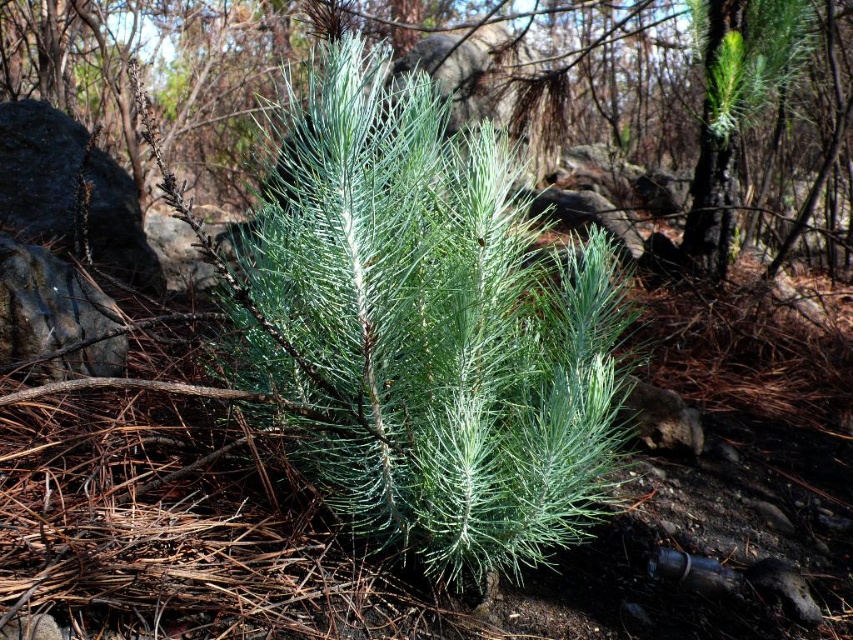
Question: Can you confirm if green needle-like plant at center is bigger than green needle-like plant at upper right?

Choices:
 (A) yes
 (B) no

Answer: (B)

Question: From the image, what is the correct spatial relationship of green needle-like plant at center in relation to green needle-like plant at upper right?

Choices:
 (A) left
 (B) right

Answer: (B)

Question: Does green needle-like plant at center appear on the left side of green needle-like plant at upper right?

Choices:
 (A) yes
 (B) no

Answer: (B)

Question: Which point is closer to the camera?

Choices:
 (A) green needle-like plant at center
 (B) green needle-like plant at upper right

Answer: (B)